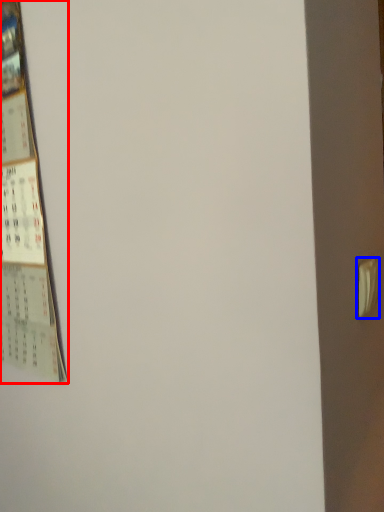
Question: Which object appears closest to the camera in this image, poster (highlighted by a red box) or door handle (highlighted by a blue box)?

Choices:
 (A) poster
 (B) door handle

Answer: (B)